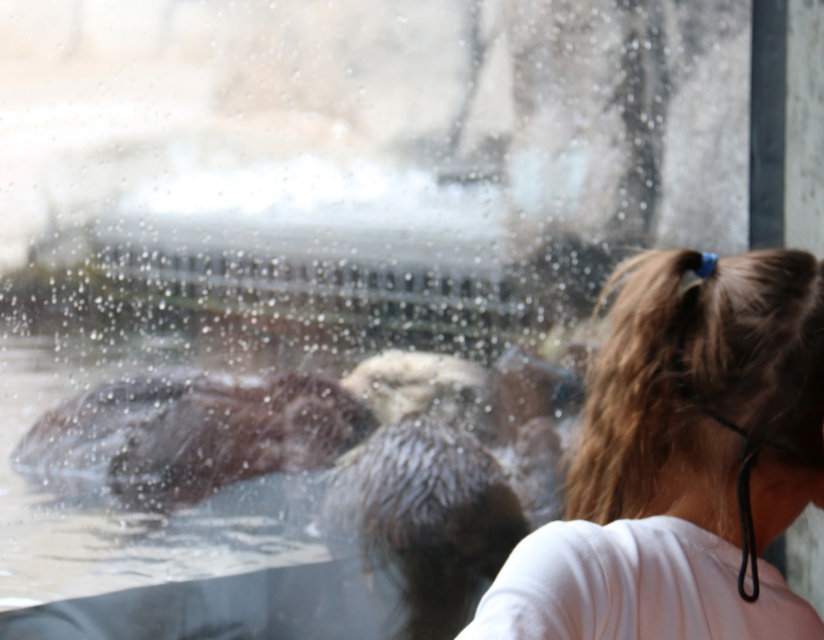
Question: Is blonde hair at upper right above brown fuzzy otter at lower left?

Choices:
 (A) yes
 (B) no

Answer: (A)

Question: Is blonde hair at upper right thinner than brown fuzzy otter at lower left?

Choices:
 (A) no
 (B) yes

Answer: (B)

Question: Where is blonde hair at upper right located in relation to brown fuzzy otter at lower left in the image?

Choices:
 (A) left
 (B) right

Answer: (B)

Question: Among these objects, which one is farthest from the camera?

Choices:
 (A) blonde hair at upper right
 (B) brown fuzzy otter at lower left

Answer: (B)